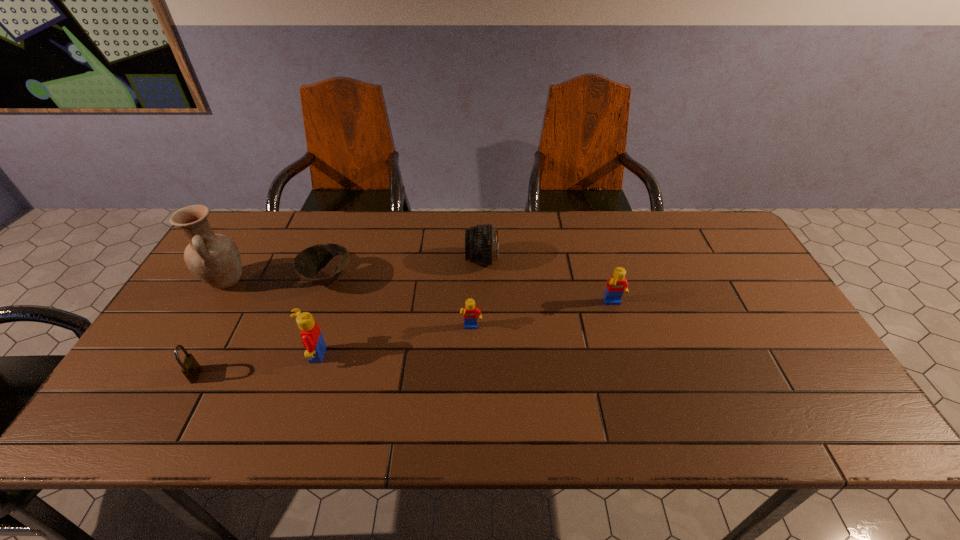
Locate an element on the screen. Image resolution: width=960 pixels, height=540 pixels. vacant space at the right edge of the desktop is located at coordinates (726, 298).

At what (x,y) coordinates should I click in order to perform the action: click on vacant region at the far left corner of the desktop. Please return your answer as a coordinate pair (x, y). This screenshot has width=960, height=540. Looking at the image, I should click on (243, 257).

In the image, there is a desktop. What are the coordinates of `vacant space at the near left corner` in the screenshot? It's located at (202, 380).

In order to click on vacant region at the far right corner of the desktop in this screenshot , I will do `click(715, 230)`.

Locate an element on the screen. This screenshot has height=540, width=960. vacant space at the near right corner is located at coordinates (817, 395).

This screenshot has width=960, height=540. Find the location of `free area in between the tallest object and the bowl`. free area in between the tallest object and the bowl is located at coordinates click(276, 280).

What are the coordinates of `unoccupied area between the sixth shortest object and the telephoto lens` in the screenshot? It's located at (397, 308).

Image resolution: width=960 pixels, height=540 pixels. I want to click on blank region between the leftmost Lego and the telephoto lens, so click(x=397, y=308).

Locate an element on the screen. The height and width of the screenshot is (540, 960). empty space that is in between the rightmost object and the sixth shortest object is located at coordinates (464, 330).

Image resolution: width=960 pixels, height=540 pixels. I want to click on vacant area between the tallest object and the second Lego from left to right, so click(348, 305).